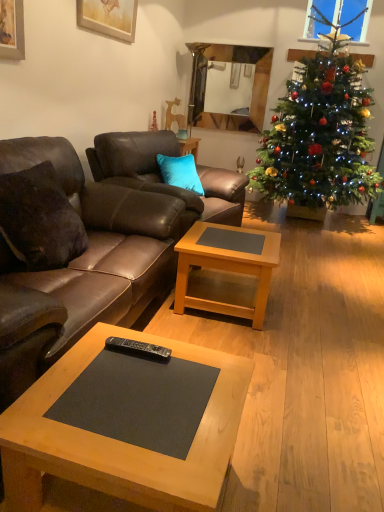
Question: Is the depth of brown leather couch at left, which is the 1th studio couch in front-to-back order, less than that of dark brown leather pillow at left?

Choices:
 (A) yes
 (B) no

Answer: (A)

Question: Can you confirm if brown leather couch at left, which is counted as the 2th studio couch, starting from the back, is taller than dark brown leather pillow at left?

Choices:
 (A) no
 (B) yes

Answer: (B)

Question: Considering the relative positions of brown leather couch at left, which is counted as the 2th studio couch, starting from the back, and dark brown leather pillow at left in the image provided, is brown leather couch at left, which is counted as the 2th studio couch, starting from the back, to the left of dark brown leather pillow at left from the viewer's perspective?

Choices:
 (A) yes
 (B) no

Answer: (A)

Question: Can you confirm if brown leather couch at left, which is counted as the 2th studio couch, starting from the back, is smaller than dark brown leather pillow at left?

Choices:
 (A) no
 (B) yes

Answer: (A)

Question: Is brown leather couch at left, which is counted as the 2th studio couch, starting from the back, facing away from dark brown leather pillow at left?

Choices:
 (A) yes
 (B) no

Answer: (A)

Question: Can you confirm if brown leather couch at left, which is the 1th studio couch in front-to-back order, is positioned to the right of dark brown leather pillow at left?

Choices:
 (A) no
 (B) yes

Answer: (A)

Question: Is glossy wood mirror at upper center looking in the opposite direction of black plastic remote control at center?

Choices:
 (A) yes
 (B) no

Answer: (B)

Question: Is glossy wood mirror at upper center beside black plastic remote control at center?

Choices:
 (A) no
 (B) yes

Answer: (A)

Question: Could you tell me if glossy wood mirror at upper center is turned towards black plastic remote control at center?

Choices:
 (A) yes
 (B) no

Answer: (A)

Question: Does glossy wood mirror at upper center come behind black plastic remote control at center?

Choices:
 (A) no
 (B) yes

Answer: (B)

Question: Can you confirm if glossy wood mirror at upper center is positioned to the right of black plastic remote control at center?

Choices:
 (A) yes
 (B) no

Answer: (A)

Question: Can you confirm if glossy wood mirror at upper center is wider than black plastic remote control at center?

Choices:
 (A) no
 (B) yes

Answer: (A)

Question: Does brown leather couch at center, positioned as the 2th studio couch in front-to-back order, have a greater height compared to wooden matte coffee table at center, acting as the second coffee table starting from the back?

Choices:
 (A) yes
 (B) no

Answer: (A)